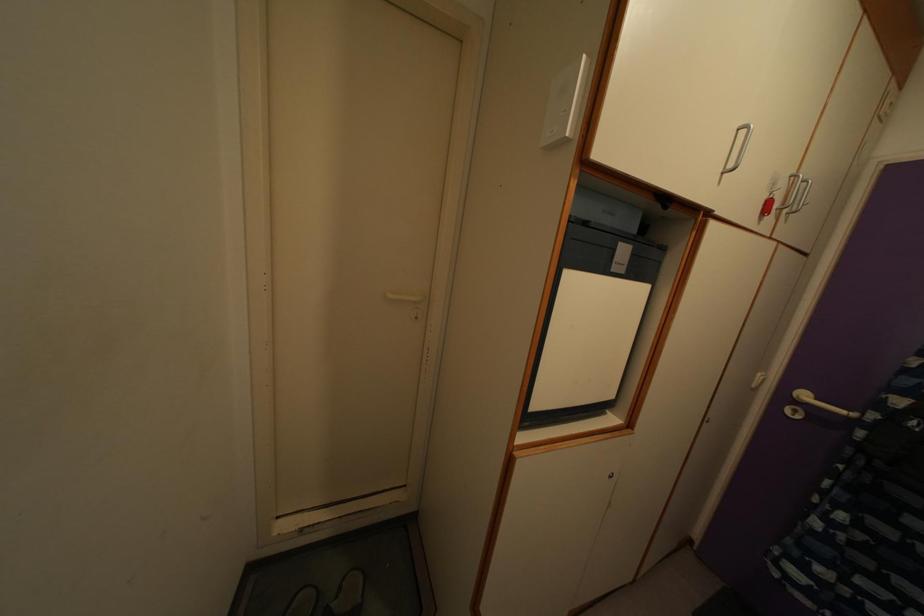
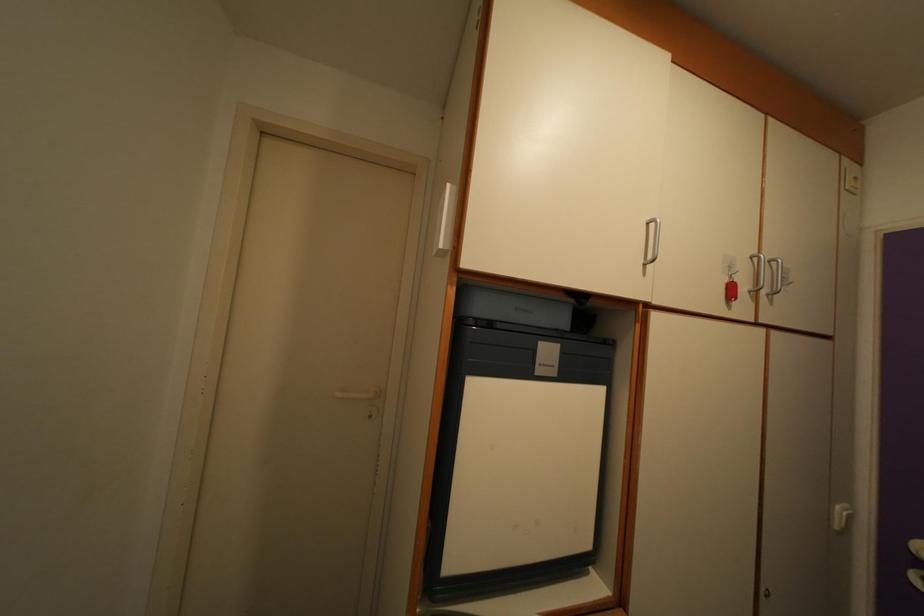
In the second image, find the point that corresponds to point (772, 211) in the first image.

(735, 294)